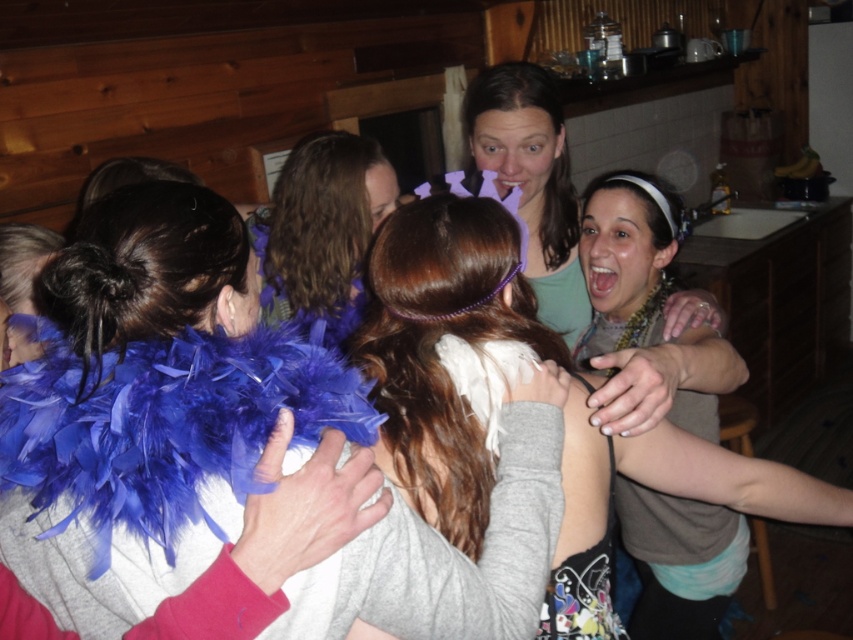
You are a photographer trying to capture a closeup of the purple feather boa at center without the matte black tank top at center blocking the view. Based on the scene description, can you position yourself in a way to avoid the tank top blocking the boa?

The matte black tank top at center is taller than the purple feather boa at center. To avoid the tank top blocking the view, you should position yourself lower, as the boa is shorter and might be visible from below the tank top.

You are standing at the center of the room and see the point marked at coordinates point (155, 412). Which object is this point located on?

The point (155, 412) is located on the blue feather boa at center.